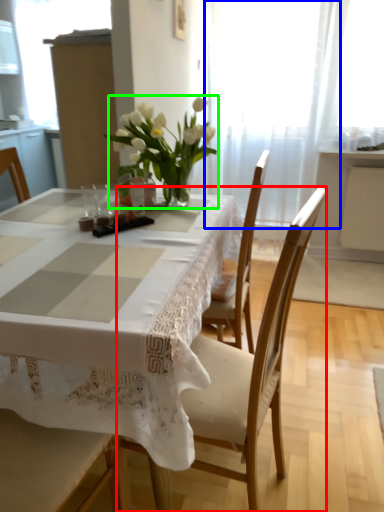
Question: Which is nearer to the chair (highlighted by a red box)? curtain (highlighted by a blue box) or houseplant (highlighted by a green box).

Choices:
 (A) curtain
 (B) houseplant

Answer: (B)